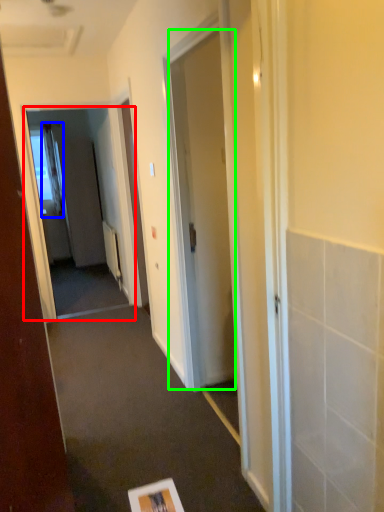
Question: Which object is the closest to the screen door (highlighted by a red box)? Choose among these: curtain (highlighted by a blue box) or door (highlighted by a green box).

Choices:
 (A) curtain
 (B) door

Answer: (A)